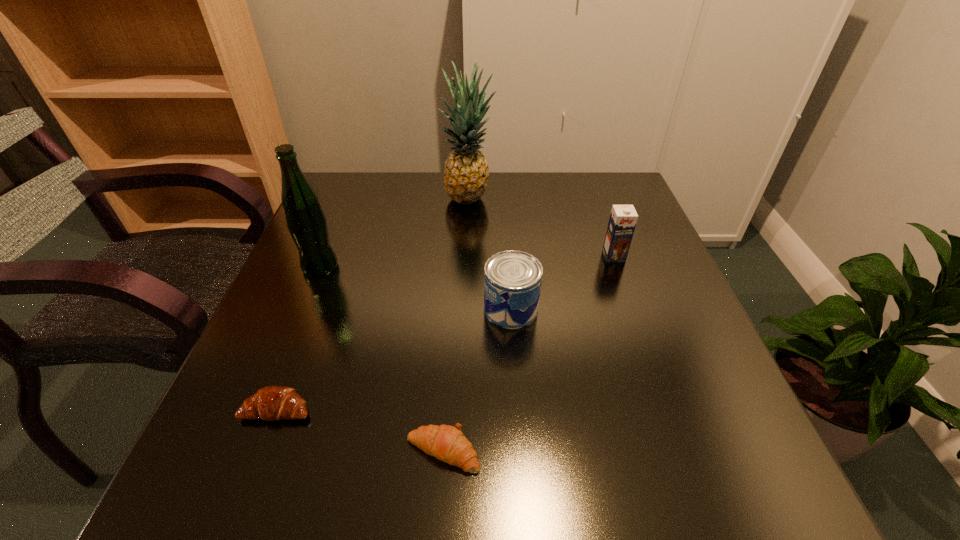
I want to click on the farthest object, so click(466, 172).

Locate an element on the screen. The height and width of the screenshot is (540, 960). pineapple is located at coordinates (466, 172).

Locate an element on the screen. beer bottle is located at coordinates (306, 222).

The width and height of the screenshot is (960, 540). I want to click on the fourth shortest object, so click(623, 218).

I want to click on the rightmost object, so click(x=623, y=218).

Image resolution: width=960 pixels, height=540 pixels. Identify the location of the third nearest object. (512, 279).

This screenshot has height=540, width=960. I want to click on the third shortest object, so click(x=512, y=279).

Where is `the fifth farthest object`? This screenshot has height=540, width=960. the fifth farthest object is located at coordinates (272, 403).

Identify the location of the left crescent roll. Image resolution: width=960 pixels, height=540 pixels. (272, 403).

Locate an element on the screen. the right crescent roll is located at coordinates (447, 443).